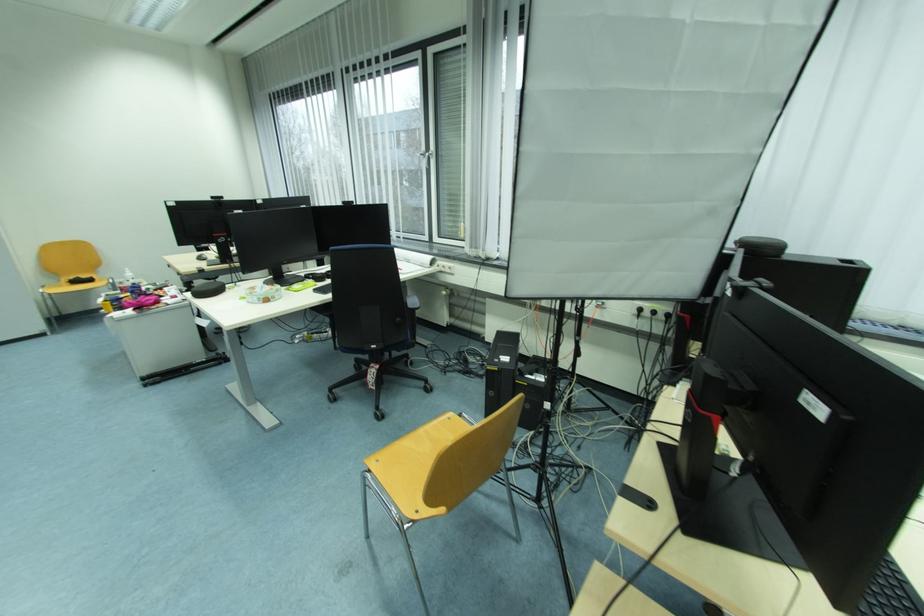
This screenshot has height=616, width=924. Describe the element at coordinates (74, 285) in the screenshot. I see `the yellow chair sitting surface` at that location.